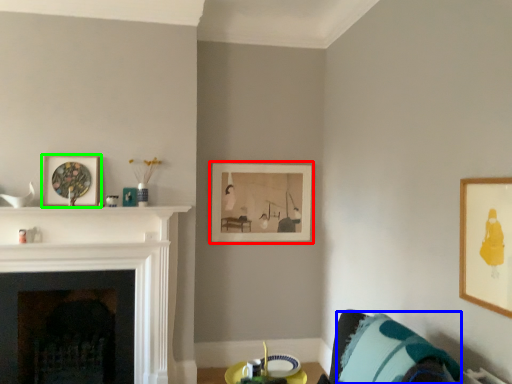
Question: Based on their relative distances, which object is farther from picture frame (highlighted by a red box)? Choose from pillow (highlighted by a blue box) and picture frame (highlighted by a green box).

Choices:
 (A) pillow
 (B) picture frame

Answer: (A)